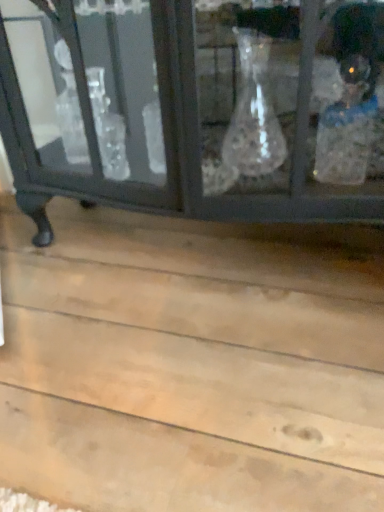
This screenshot has height=512, width=384. What are the coordinates of `free space in front of matte black cabinet at upper center` in the screenshot? It's located at (193, 367).